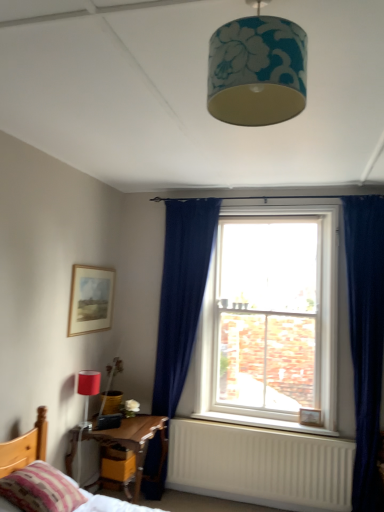
At what (x,y) coordinates should I click in order to perform the action: click on free space above matte gold picture frame at upper left, which is the first picture frame from left to right (from a real-world perspective). Please return your answer as a coordinate pair (x, y). Image resolution: width=384 pixels, height=512 pixels. Looking at the image, I should click on (94, 268).